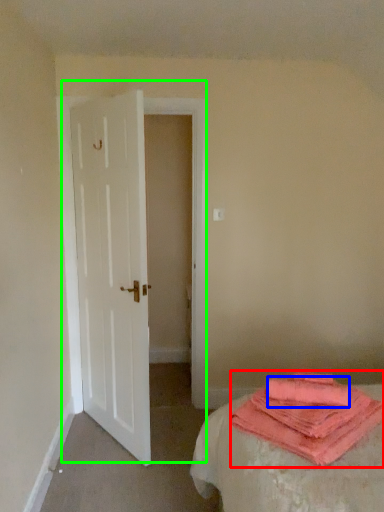
Question: Which is farther away from cloth (highlighted by a red box)? beach towel (highlighted by a blue box) or door (highlighted by a green box)?

Choices:
 (A) beach towel
 (B) door

Answer: (B)